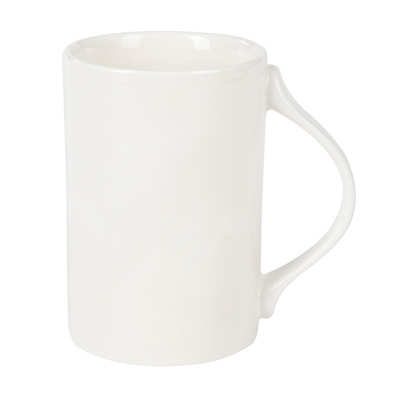
This screenshot has width=400, height=400. I want to click on 6 points spread around the handle of the cup, so click(281, 99), click(317, 134), click(348, 190), click(330, 238), click(300, 264), click(274, 284).